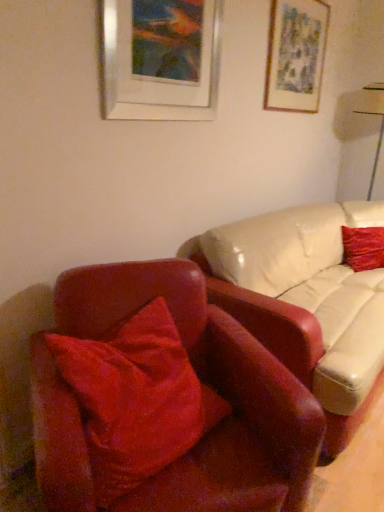
Question: Is white glossy table lamp at upper right positioned with its back to velvet red pillow at left, marked as the second pillow in a back-to-front arrangement?

Choices:
 (A) yes
 (B) no

Answer: (B)

Question: From the image's perspective, is white glossy table lamp at upper right located above velvet red pillow at left, which appears as the second pillow when viewed from the top?

Choices:
 (A) yes
 (B) no

Answer: (A)

Question: Considering the relative sizes of white glossy table lamp at upper right and velvet red pillow at left, which appears as the second pillow when viewed from the top, in the image provided, is white glossy table lamp at upper right bigger than velvet red pillow at left, which appears as the second pillow when viewed from the top,?

Choices:
 (A) yes
 (B) no

Answer: (A)

Question: Is velvet red pillow at left, the 1th pillow when ordered from left to right, surrounded by white glossy table lamp at upper right?

Choices:
 (A) yes
 (B) no

Answer: (B)

Question: Is white glossy table lamp at upper right not close to velvet red pillow at left, the 2th pillow in the right-to-left sequence?

Choices:
 (A) yes
 (B) no

Answer: (A)

Question: Is white glossy table lamp at upper right beside velvet red pillow at left, which is the 1th pillow from bottom to top?

Choices:
 (A) yes
 (B) no

Answer: (B)

Question: Considering the relative sizes of velvet red pillow at left, marked as the second pillow in a back-to-front arrangement, and metallic silver picture frame at upper center, the second picture frame viewed from the right, in the image provided, is velvet red pillow at left, marked as the second pillow in a back-to-front arrangement, bigger than metallic silver picture frame at upper center, the second picture frame viewed from the right,?

Choices:
 (A) no
 (B) yes

Answer: (B)

Question: Considering the relative positions of velvet red pillow at left, marked as the second pillow in a back-to-front arrangement, and metallic silver picture frame at upper center, the second picture frame viewed from the right, in the image provided, is velvet red pillow at left, marked as the second pillow in a back-to-front arrangement, to the right of metallic silver picture frame at upper center, the second picture frame viewed from the right, from the viewer's perspective?

Choices:
 (A) yes
 (B) no

Answer: (B)

Question: Can you confirm if velvet red pillow at left, which appears as the second pillow when viewed from the top, is smaller than metallic silver picture frame at upper center, the second picture frame viewed from the back?

Choices:
 (A) no
 (B) yes

Answer: (A)

Question: Is the depth of velvet red pillow at left, marked as the second pillow in a back-to-front arrangement, greater than that of metallic silver picture frame at upper center, positioned as the 1th picture frame in front-to-back order?

Choices:
 (A) no
 (B) yes

Answer: (A)

Question: From the image's perspective, is velvet red pillow at left, marked as the second pillow in a back-to-front arrangement, located beneath metallic silver picture frame at upper center, the second picture frame viewed from the back?

Choices:
 (A) yes
 (B) no

Answer: (A)

Question: Are velvet red pillow at left, which appears as the second pillow when viewed from the top, and metallic silver picture frame at upper center, the second picture frame viewed from the right, beside each other?

Choices:
 (A) yes
 (B) no

Answer: (B)

Question: Does matte gray picture frame at upper right, the first picture frame viewed from the right, have a lesser width compared to white glossy table lamp at upper right?

Choices:
 (A) yes
 (B) no

Answer: (A)